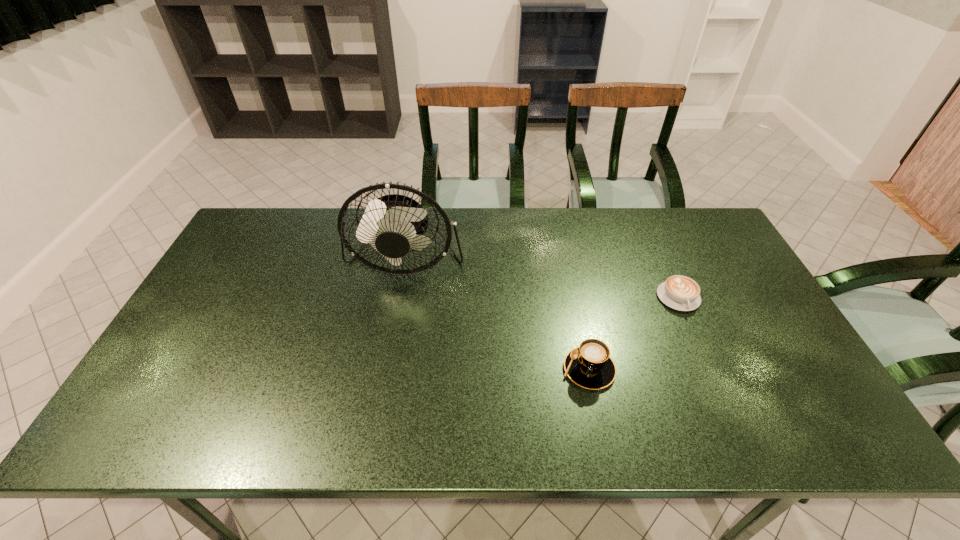
The width and height of the screenshot is (960, 540). I want to click on vacant space at the far edge of the desktop, so click(298, 228).

This screenshot has width=960, height=540. Identify the location of vacant space at the near edge of the desktop. (464, 410).

Locate an element on the screen. Image resolution: width=960 pixels, height=540 pixels. vacant point at the left edge is located at coordinates [x=166, y=379].

In the image, there is a desktop. Identify the location of vacant area at the right edge. (732, 326).

Image resolution: width=960 pixels, height=540 pixels. Identify the location of vacant space that's between the left cappuccino and the farther cappuccino. (634, 333).

The height and width of the screenshot is (540, 960). What are the coordinates of `empty space between the right cappuccino and the fan` in the screenshot? It's located at (542, 279).

Find the location of a particular element. free area in between the farther cappuccino and the taller cappuccino is located at coordinates (634, 333).

Locate an element on the screen. Image resolution: width=960 pixels, height=540 pixels. vacant region between the tallest object and the second tallest object is located at coordinates (497, 314).

The image size is (960, 540). Identify the location of empty space that is in between the nearest object and the shorter cappuccino. (634, 333).

The image size is (960, 540). I want to click on free space between the tallest object and the shortest object, so click(542, 279).